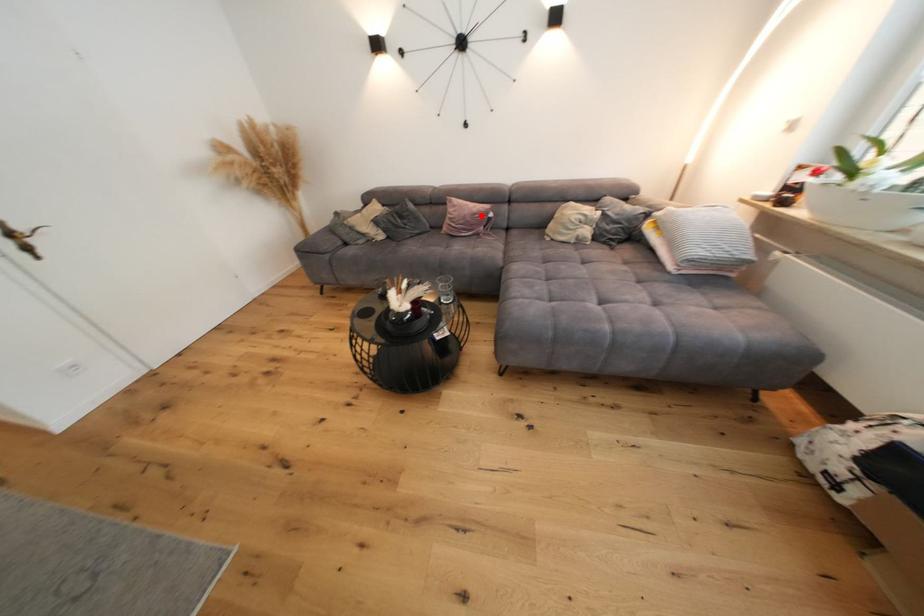
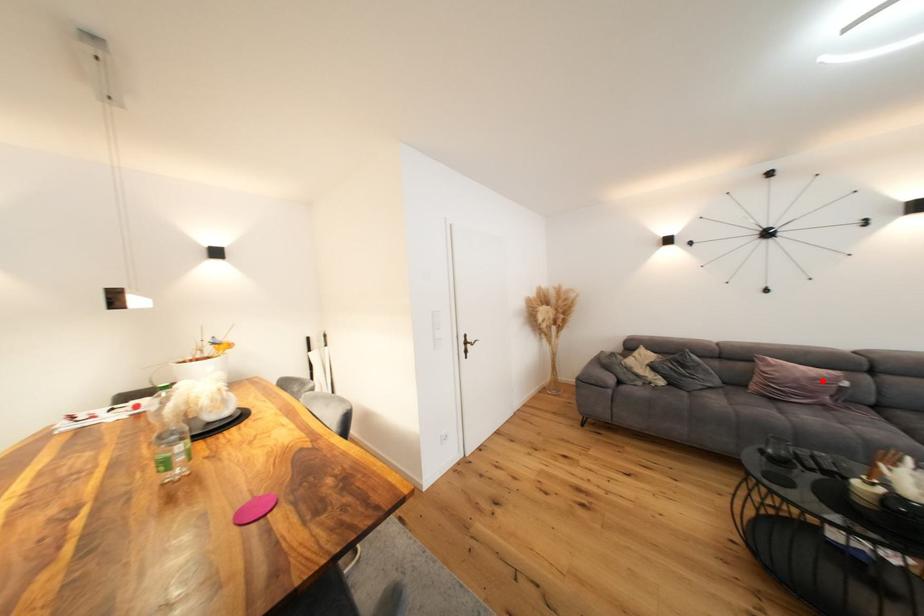
I am providing you with two images of the same scene from different viewpoints. A red point is marked on the first image and another point is marked on the second image. Does the point marked in image1 correspond to the same location as the one in image2?

Yes